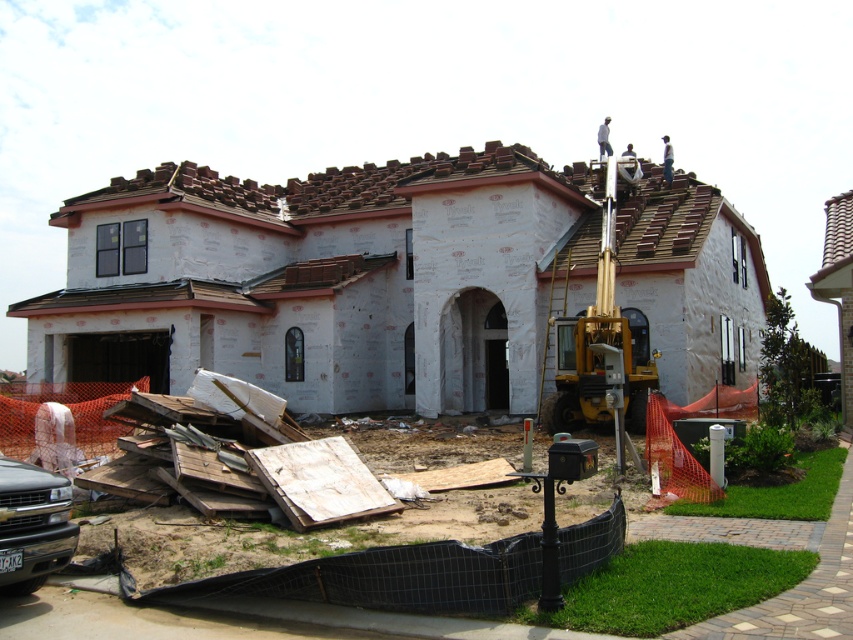
Question: Which object is farther from the camera taking this photo?

Choices:
 (A) matte black truck at lower left
 (B) white foam insulation at lower left

Answer: (A)

Question: Is white foam insulation at lower left bigger than matte black truck at lower left?

Choices:
 (A) no
 (B) yes

Answer: (B)

Question: Is white foam insulation at lower left below matte black truck at lower left?

Choices:
 (A) yes
 (B) no

Answer: (A)

Question: Does white foam insulation at lower left have a lesser width compared to matte black truck at lower left?

Choices:
 (A) no
 (B) yes

Answer: (A)

Question: Which object appears farthest from the camera in this image?

Choices:
 (A) white foam insulation at lower left
 (B) matte black truck at lower left

Answer: (B)